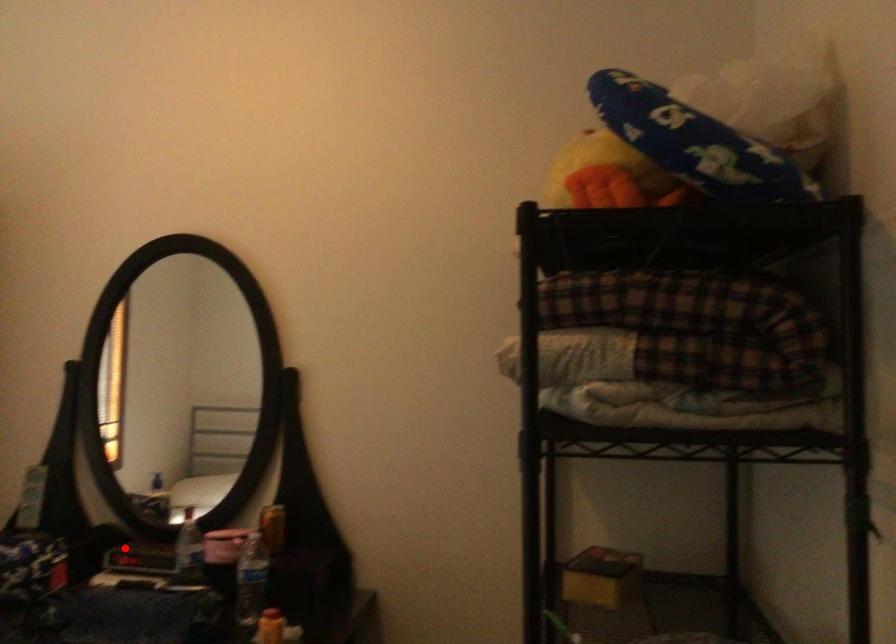
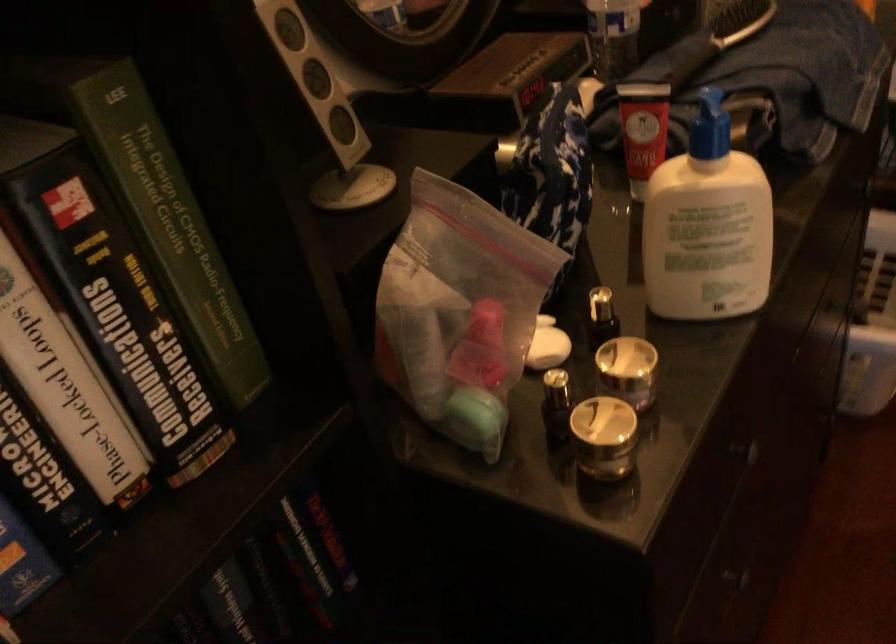
The point at the highlighted location is marked in the first image. Where is the corresponding point in the second image?

(506, 80)